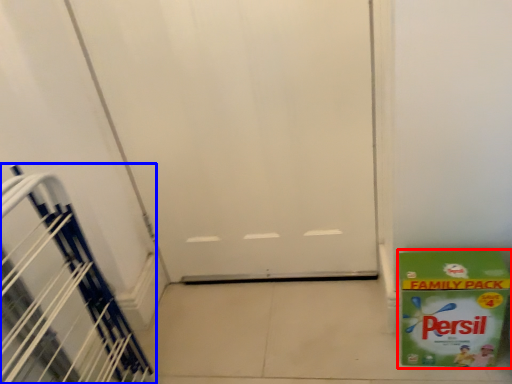
Question: Which of the following is the closest to the observer, box (highlighted by a red box) or stairwell (highlighted by a blue box)?

Choices:
 (A) box
 (B) stairwell

Answer: (B)